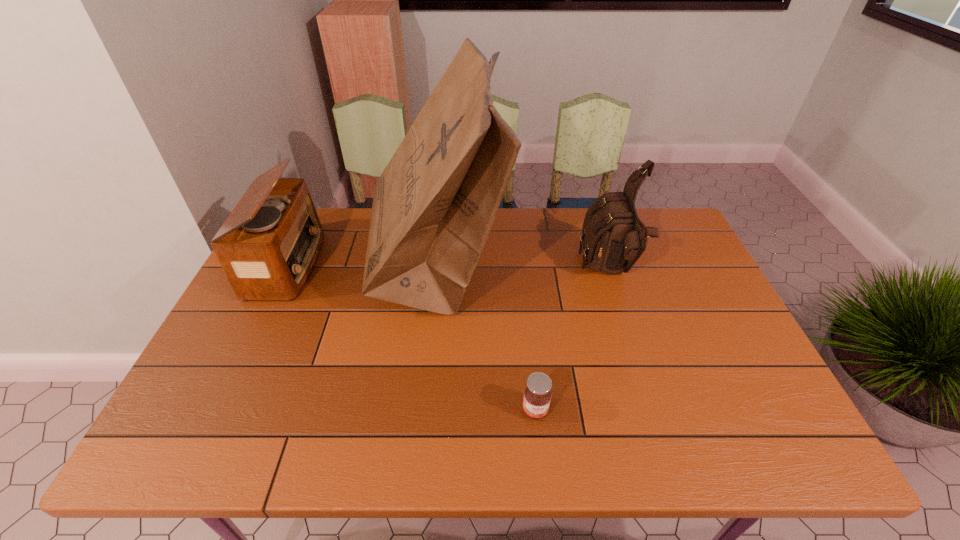
The width and height of the screenshot is (960, 540). In the image, there is a desktop. In order to click on blank space at the right edge in this screenshot , I will do `click(710, 400)`.

In the image, there is a desktop. Where is `vacant space at the near left corner`? The image size is (960, 540). vacant space at the near left corner is located at coordinates [165, 438].

Where is `empty space that is in between the shortest object and the tallest object`? This screenshot has width=960, height=540. empty space that is in between the shortest object and the tallest object is located at coordinates (487, 339).

Locate an element on the screen. This screenshot has height=540, width=960. vacant region between the grocery bag and the shortest object is located at coordinates (487, 339).

This screenshot has height=540, width=960. In order to click on unoccupied position between the third object from right to left and the radio receiver in this screenshot , I will do `click(363, 266)`.

What are the coordinates of `blank region between the rightmost object and the jam` in the screenshot? It's located at (572, 341).

The height and width of the screenshot is (540, 960). I want to click on free spot between the grocery bag and the jam, so click(x=487, y=339).

Locate an element on the screen. Image resolution: width=960 pixels, height=540 pixels. vacant space in between the shortest object and the tallest object is located at coordinates (487, 339).

Identify which object is the second nearest to the second object from left to right. Please provide its 2D coordinates. Your answer should be formatted as a tuple, i.e. [(x, y)], where the tuple contains the x and y coordinates of a point satisfying the conditions above.

[(537, 395)]

I want to click on object that is the closest to the leftmost object, so click(434, 205).